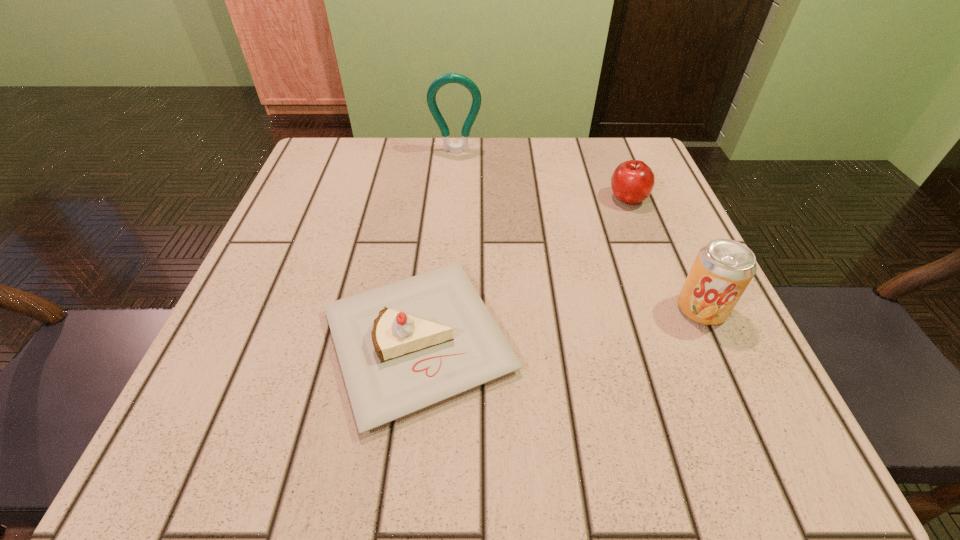
Locate an element on the screen. free space between the cake and the third tallest object is located at coordinates (523, 269).

The height and width of the screenshot is (540, 960). In order to click on empty space that is in between the second farthest object and the second tallest object in this screenshot , I will do `click(664, 254)`.

At what (x,y) coordinates should I click in order to perform the action: click on free point between the farthest object and the pop (soda). Please return your answer as a coordinate pair (x, y). The image size is (960, 540). Looking at the image, I should click on (579, 230).

Where is `empty space between the bottle opener and the apple`? empty space between the bottle opener and the apple is located at coordinates (542, 175).

The height and width of the screenshot is (540, 960). I want to click on vacant area that lies between the shortest object and the bottle opener, so click(x=437, y=246).

What are the coordinates of `object that is the second closest to the tallest object` in the screenshot? It's located at (402, 347).

Locate an element on the screen. Image resolution: width=960 pixels, height=540 pixels. object that can be found as the second closest to the apple is located at coordinates [x=402, y=347].

I want to click on vacant space that satisfies the following two spatial constraints: 1. on the back side of the shortest object; 2. on the right side of the third nearest object, so click(x=435, y=198).

Image resolution: width=960 pixels, height=540 pixels. In order to click on vacant space that satisfies the following two spatial constraints: 1. on the back side of the second shortest object; 2. on the right side of the cake in this screenshot , I will do `click(435, 198)`.

The height and width of the screenshot is (540, 960). I want to click on vacant space that satisfies the following two spatial constraints: 1. at the jaws of the tallest object; 2. on the left side of the second tallest object, so click(444, 309).